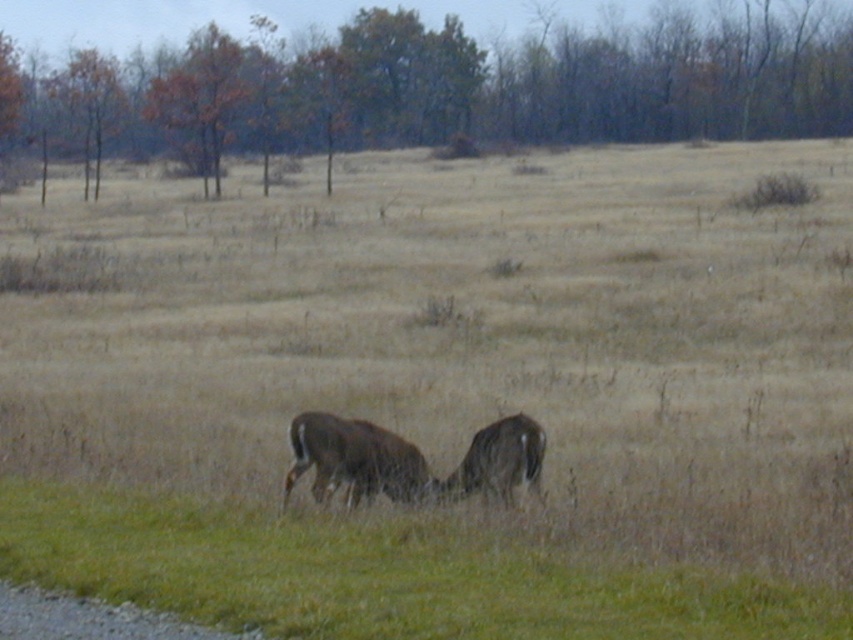
You are standing at the origin point of the coordinate system in this rural landscape scene. You want to walk towards the green grass at lower center. What are the coordinates you should head towards?

The coordinates you should head towards are 0.902 in the x direction and 0.441 in the y direction.

You are standing at the edge of the scene and want to walk towards the brown fur deer at center. Will you step on the green grass at lower center before reaching the deer?

Yes, because the green grass at lower center is in front of the brown fur deer at center, so you would step on it before reaching the deer.

You are a photographer standing in the field. You want to take a photo of the green grass at lower center and the brown fur deer at center. Can you fit both subjects in the frame if your camera has a 10 feet wide field of view?

The green grass at lower center and the brown fur deer at center are 10.54 feet apart from each other. Since the distance between them exceeds the camera field of view by 0.54 feet, you cannot fit both subjects in the frame.